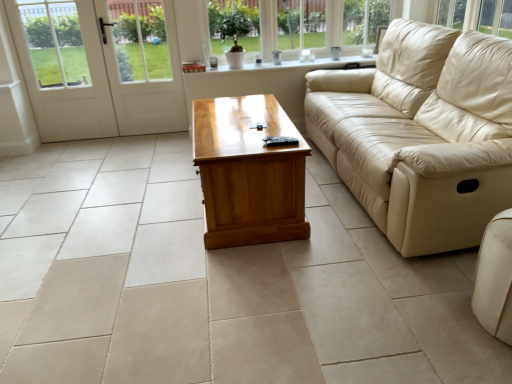
You are a GUI agent. You are given a task and a screenshot of the screen. Output one action in this format:
    pyautogui.click(x=<x>, y=<y>)
    Task: Click on the free area in between light brown wood coffee table at center and beige leather couch at lower right, marked as the 2th studio couch in a top-to-bottom arrangement
    The width and height of the screenshot is (512, 384).
    Given the screenshot: What is the action you would take?
    pyautogui.click(x=355, y=263)